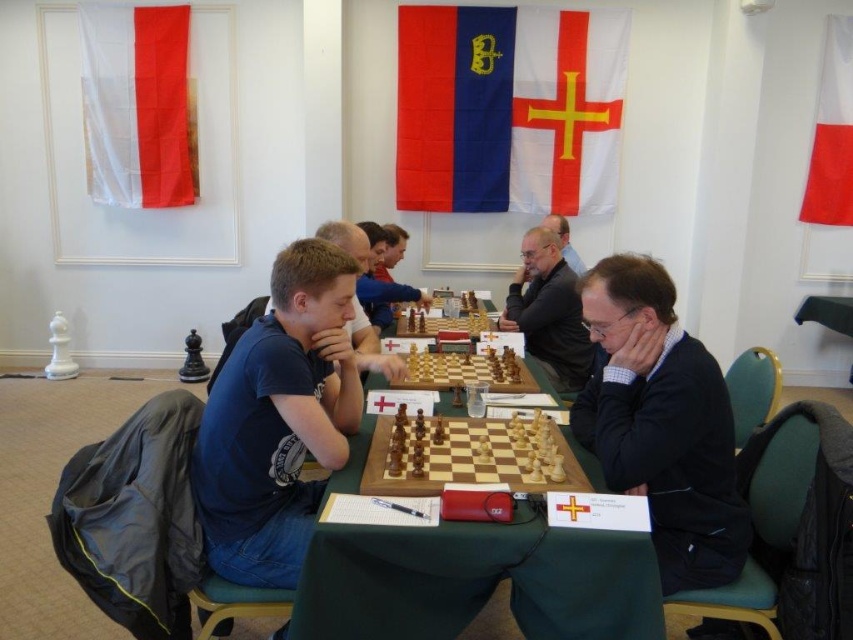
Question: In this image, where is wooden at center located relative to wooden chessboard at center?

Choices:
 (A) right
 (B) left

Answer: (A)

Question: Can you confirm if wooden at center is positioned to the right of blue cotton shirt at center?

Choices:
 (A) yes
 (B) no

Answer: (A)

Question: Can you confirm if wooden at center is smaller than matte black sweater at center?

Choices:
 (A) yes
 (B) no

Answer: (A)

Question: Which point is closer to the camera taking this photo?

Choices:
 (A) (329, 227)
 (B) (361, 598)

Answer: (B)

Question: Which point is farther to the camera?

Choices:
 (A) (648, 324)
 (B) (576, 308)
 (C) (364, 262)

Answer: (B)

Question: Which point is closer to the camera?

Choices:
 (A) matte black sweater at center
 (B) blue cotton shirt at center

Answer: (B)